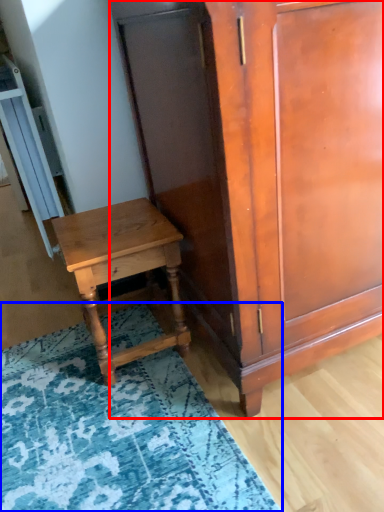
Question: Which point is further to the camera, cabinetry (highlighted by a red box) or mat (highlighted by a blue box)?

Choices:
 (A) cabinetry
 (B) mat

Answer: (B)